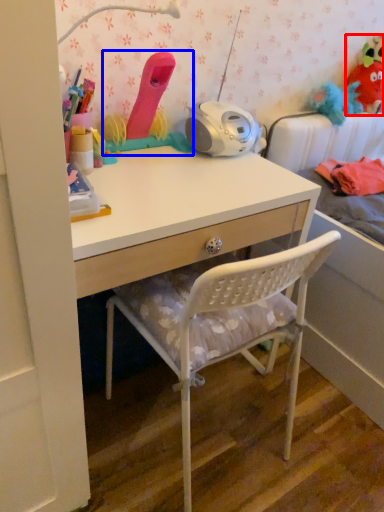
Question: Which point is further to the camera, toy (highlighted by a red box) or toy (highlighted by a blue box)?

Choices:
 (A) toy
 (B) toy

Answer: (A)